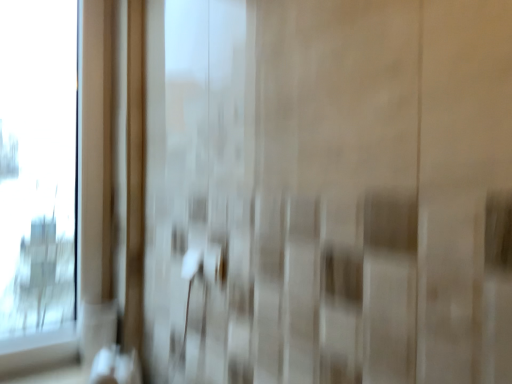
Question: Is white plastic door handle at center positioned before transparent glass window at left?

Choices:
 (A) no
 (B) yes

Answer: (B)

Question: Is white plastic door handle at center positioned beyond the bounds of transparent glass window at left?

Choices:
 (A) yes
 (B) no

Answer: (A)

Question: Are white plastic door handle at center and transparent glass window at left located far from each other?

Choices:
 (A) no
 (B) yes

Answer: (A)

Question: Is white plastic door handle at center beside transparent glass window at left?

Choices:
 (A) no
 (B) yes

Answer: (A)

Question: Can you confirm if white plastic door handle at center is thinner than transparent glass window at left?

Choices:
 (A) no
 (B) yes

Answer: (B)

Question: From a real-world perspective, is white plastic door handle at center physically below transparent glass window at left?

Choices:
 (A) no
 (B) yes

Answer: (B)

Question: Considering the relative sizes of transparent glass window at left and white plastic door handle at center in the image provided, is transparent glass window at left bigger than white plastic door handle at center?

Choices:
 (A) yes
 (B) no

Answer: (A)

Question: Is transparent glass window at left to the left of white plastic door handle at center from the viewer's perspective?

Choices:
 (A) yes
 (B) no

Answer: (A)

Question: Are transparent glass window at left and white plastic door handle at center located far from each other?

Choices:
 (A) no
 (B) yes

Answer: (A)

Question: Is transparent glass window at left further to the viewer compared to white plastic door handle at center?

Choices:
 (A) yes
 (B) no

Answer: (A)

Question: Is transparent glass window at left oriented towards white plastic door handle at center?

Choices:
 (A) yes
 (B) no

Answer: (A)

Question: Considering the relative positions of transparent glass window at left and white plastic door handle at center in the image provided, is transparent glass window at left in front of white plastic door handle at center?

Choices:
 (A) yes
 (B) no

Answer: (B)

Question: From their relative heights in the image, would you say white plastic door handle at center is taller or shorter than transparent glass window at left?

Choices:
 (A) short
 (B) tall

Answer: (A)